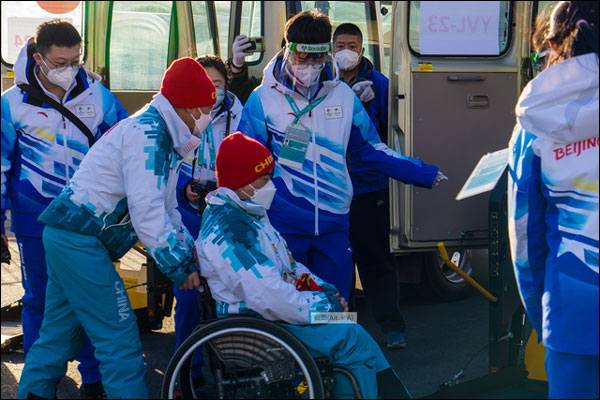
You are a GUI agent. You are given a task and a screenshot of the screen. Output one action in this format:
    pyautogui.click(x=<x>, y=<y>)
    Task: Click on the door
    The width and height of the screenshot is (600, 400).
    Given the screenshot: What is the action you would take?
    pyautogui.click(x=441, y=118)